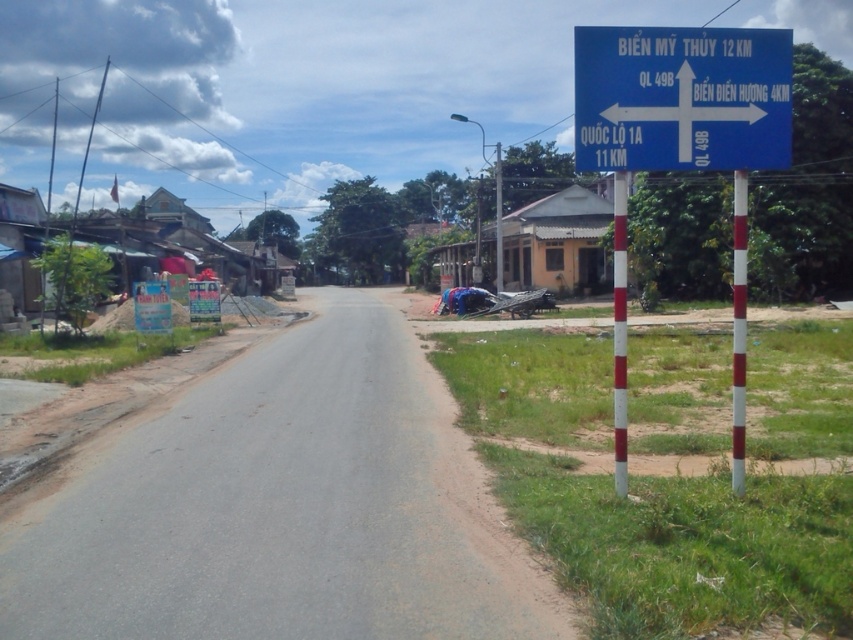
You are a delivery driver who needs to take a photo of the blue plastic signpost at right for your route documentation. Your vehicle has a camera mounted on the dashboard that can capture objects within a 5 meter range. Can you take the photo from your current position without moving the vehicle?

The blue plastic signpost at right and camera are 5.50 meters apart from each other. Since the camera can only capture objects within 5 meters, the distance is too far. You need to move closer to take the photo.